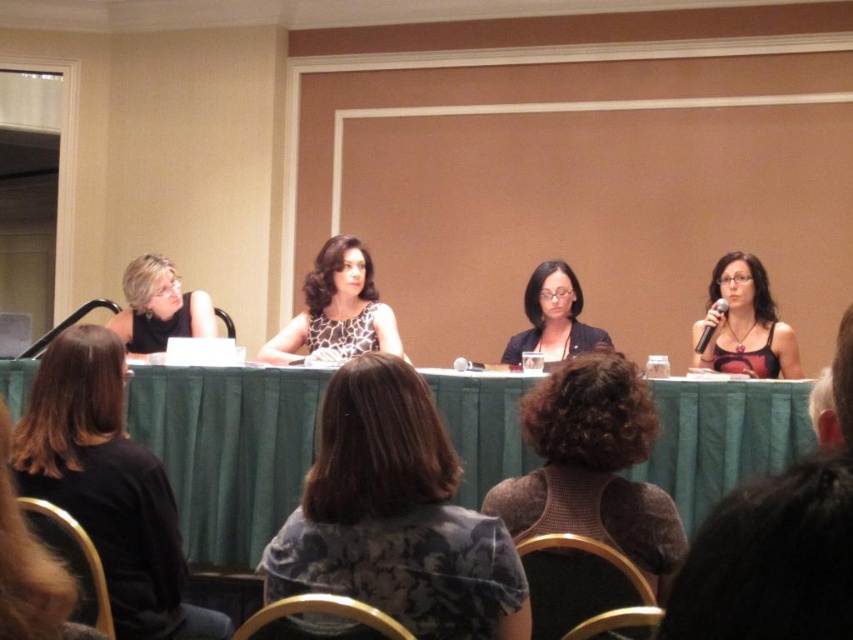
Question: Is green fabric table at center below dark gray textured blouse at center?

Choices:
 (A) no
 (B) yes

Answer: (B)

Question: Does green fabric table at center appear on the left side of matte black blazer at center?

Choices:
 (A) yes
 (B) no

Answer: (A)

Question: Where is dark gray textured blouse at center located in relation to matte black blazer at center in the image?

Choices:
 (A) right
 (B) left

Answer: (B)

Question: Which of the following is the closest to the observer?

Choices:
 (A) matte black blazer at center
 (B) green fabric table at center
 (C) matte black tank top at right
 (D) glossy leopard print dress at center

Answer: (B)

Question: Among these objects, which one is nearest to the camera?

Choices:
 (A) green fabric table at center
 (B) brown textured sweater at center
 (C) black fabric shirt at lower left

Answer: (B)

Question: Which point is farther to the camera?

Choices:
 (A) black fabric shirt at lower left
 (B) brown textured sweater at center

Answer: (A)